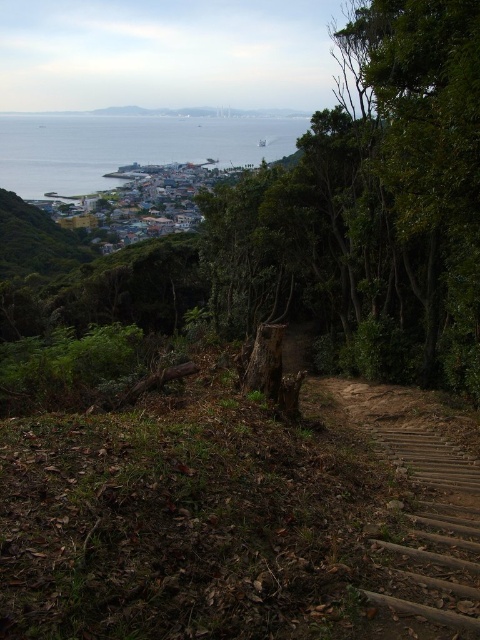
You are standing at the top of the hill and want to take a photo of the green rough bark tree at center. According to the coordinates given, where should you aim your camera?

You should aim your camera at point 0.314 on the horizontal axis and 0.787 on the vertical axis to capture the green rough bark tree at center.

You are a hiker standing on the dirt path bordered by wooden planks. You see the green rough bark tree at center and the blue water at center. Which object is shorter?

The green rough bark tree at center is not as tall as the blue water at center, so the green rough bark tree at center is shorter.

You are a hiker standing on the dirt path and want to cross to the town below. You notice the green rough bark tree at center and the blue water at center. Which object is closer to you as you look towards the town?

The green rough bark tree at center is closer to you than the blue water at center because it is positioned under it, meaning the tree is in front of the water from your perspective.